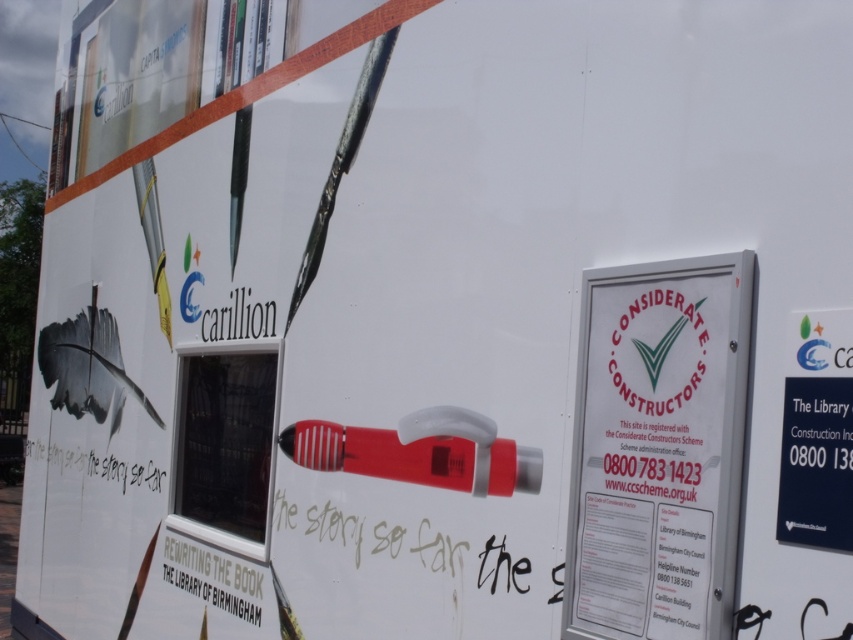
I want to click on white plastic sign at center, so click(x=659, y=449).

Between point (646, 404) and point (445, 470), which one is positioned behind?

The point (445, 470) is behind.

Where is `white plastic sign at center`? Image resolution: width=853 pixels, height=640 pixels. white plastic sign at center is located at coordinates (659, 449).